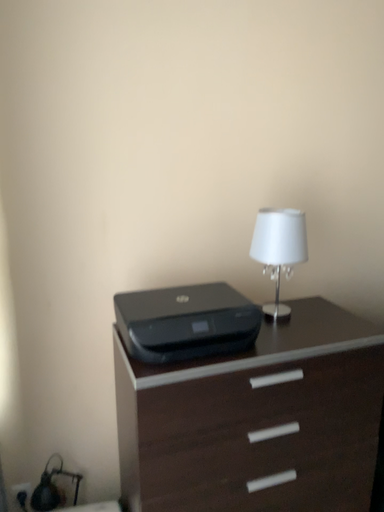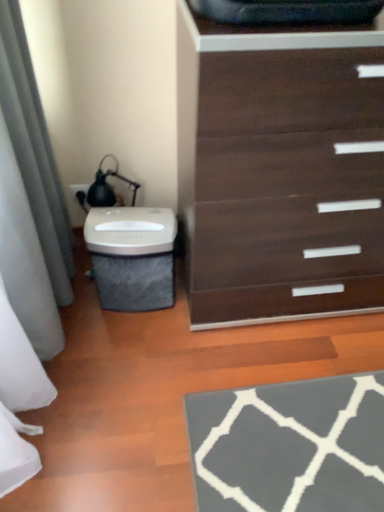
Question: How did the camera likely rotate when shooting the video?

Choices:
 (A) rotated left
 (B) rotated right

Answer: (A)